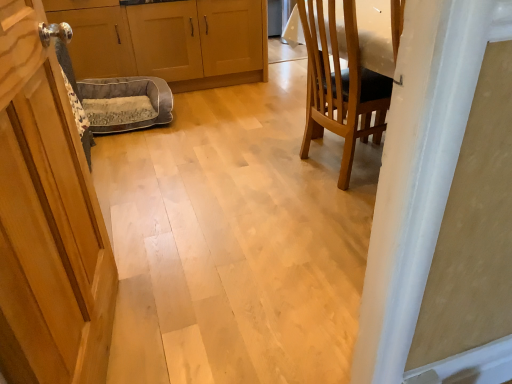
Where is `free spot to the right of gray fabric dog bed at center`? free spot to the right of gray fabric dog bed at center is located at coordinates (206, 115).